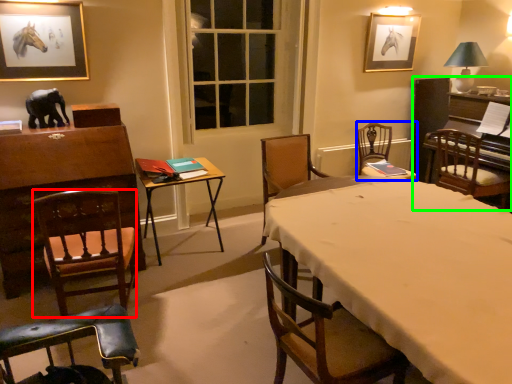
Question: Which is nearer to the chair (highlighted by a red box)? chair (highlighted by a blue box) or piano (highlighted by a green box).

Choices:
 (A) chair
 (B) piano

Answer: (A)